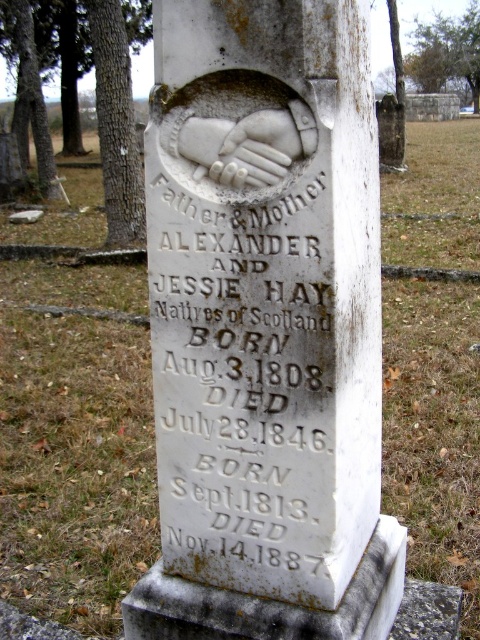
From the picture: You are a historian examining the gravestone and notice both the white stone inscription at center and the white marble hand at center. Based on their positions, which one do you think is placed lower on the gravestone?

The white stone inscription at center is below the white marble hand at center, so it is placed lower on the gravestone.